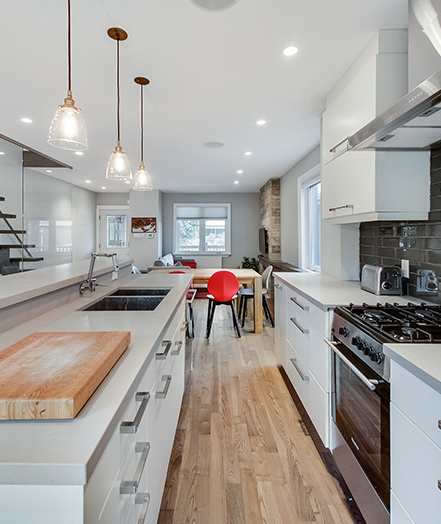
You are a GUI agent. You are given a task and a screenshot of the screen. Output one action in this format:
    pyautogui.click(x=<x>, y=<y>)
    Task: Click on the windows
    
    Given the screenshot: What is the action you would take?
    pyautogui.click(x=41, y=236), pyautogui.click(x=68, y=236), pyautogui.click(x=117, y=229), pyautogui.click(x=185, y=231), pyautogui.click(x=221, y=231), pyautogui.click(x=309, y=238)